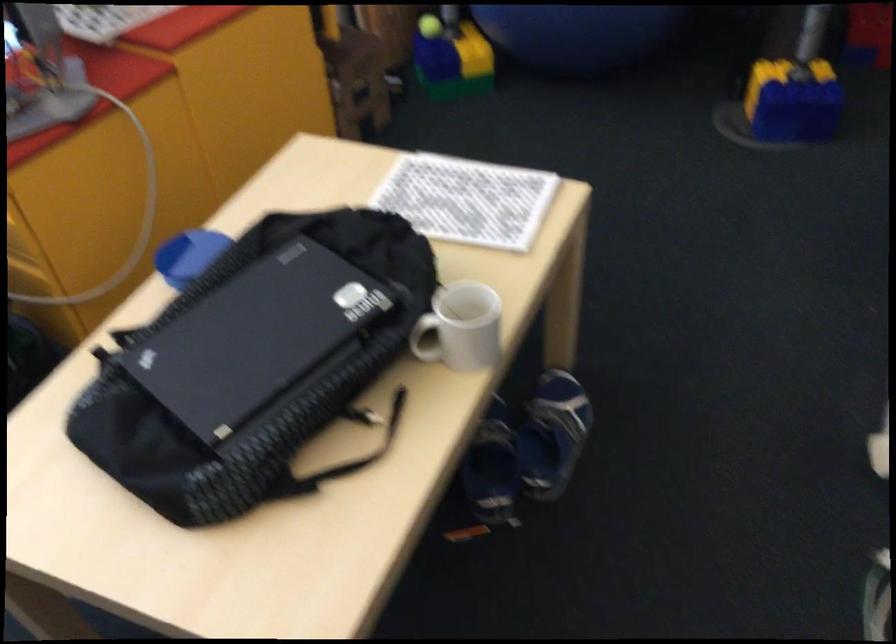
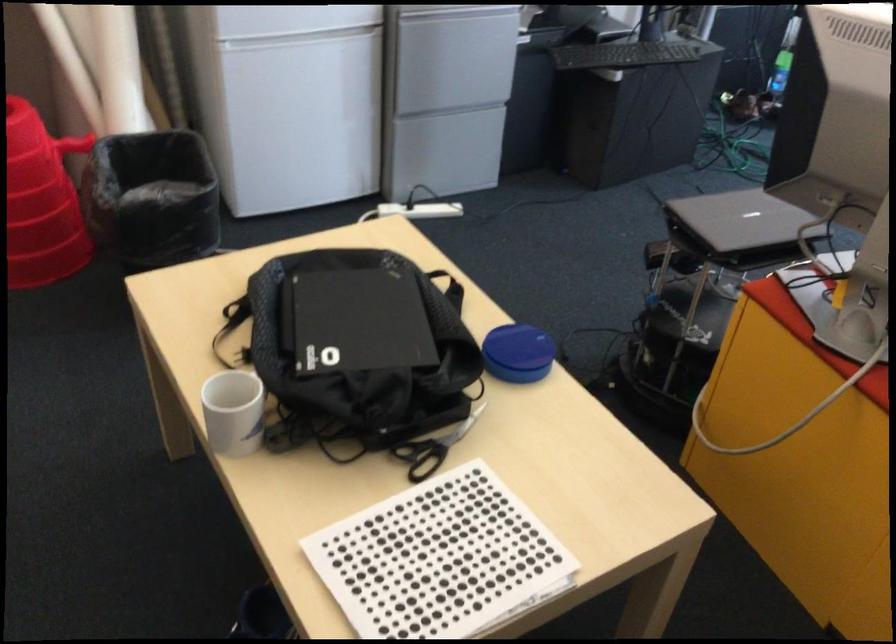
Find the pixel in the second image that matches point (133, 346) in the first image.

(450, 289)